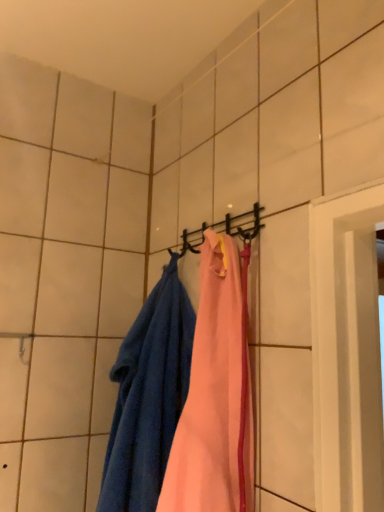
Measure the distance between blue terry cloth towel at left and camera.

blue terry cloth towel at left and camera are 76.22 centimeters apart from each other.

Image resolution: width=384 pixels, height=512 pixels. What do you see at coordinates (148, 396) in the screenshot?
I see `blue terry cloth towel at left` at bounding box center [148, 396].

Locate an element on the screen. This screenshot has width=384, height=512. blue terry cloth towel at left is located at coordinates (148, 396).

Find the location of a particular element. The image size is (384, 512). metallic black hanger at center is located at coordinates (225, 229).

This screenshot has width=384, height=512. Describe the element at coordinates (225, 229) in the screenshot. I see `metallic black hanger at center` at that location.

Find the location of `blue terry cloth towel at left`. blue terry cloth towel at left is located at coordinates (148, 396).

Which object is positioned more to the right, metallic black hanger at center or blue terry cloth towel at left?

metallic black hanger at center.

Is the depth of metallic black hanger at center less than that of blue terry cloth towel at left?

No, metallic black hanger at center is further to the viewer.

Which is in front, point (248, 220) or point (129, 396)?

The point (248, 220) is in front.

From the image's perspective, who appears lower, metallic black hanger at center or blue terry cloth towel at left?

blue terry cloth towel at left, from the image's perspective.

From a real-world perspective, between metallic black hanger at center and blue terry cloth towel at left, who is vertically lower?

From a 3D spatial view, blue terry cloth towel at left is below.

Looking at their sizes, would you say metallic black hanger at center is wider or thinner than blue terry cloth towel at left?

Considering their sizes, metallic black hanger at center looks slimmer than blue terry cloth towel at left.

Which of these two, metallic black hanger at center or blue terry cloth towel at left, stands shorter?

Standing shorter between the two is metallic black hanger at center.

Based on their sizes in the image, would you say metallic black hanger at center is bigger or smaller than blue terry cloth towel at left?

metallic black hanger at center is smaller than blue terry cloth towel at left.

Is metallic black hanger at center positioned beyond the bounds of blue terry cloth towel at left?

Indeed, metallic black hanger at center is completely outside blue terry cloth towel at left.

Can you see metallic black hanger at center touching blue terry cloth towel at left?

No, metallic black hanger at center is not next to blue terry cloth towel at left.

Is metallic black hanger at center positioned with its back to blue terry cloth towel at left?

That's right, metallic black hanger at center is facing away from blue terry cloth towel at left.

How different are the orientations of metallic black hanger at center and blue terry cloth towel at left in degrees?

The angle between the facing direction of metallic black hanger at center and the facing direction of blue terry cloth towel at left is 0.000777 degrees.

Locate an element on the screen. The height and width of the screenshot is (512, 384). hanger that is on the right side of blue terry cloth towel at left is located at coordinates (225, 229).

Is blue terry cloth towel at left at the left side of metallic black hanger at center?

Indeed, blue terry cloth towel at left is positioned on the left side of metallic black hanger at center.

Which object is further away from the camera, blue terry cloth towel at left or metallic black hanger at center?

metallic black hanger at center is further from the camera.

Is point (159, 450) in front of point (254, 227)?

No.

From the image's perspective, who appears lower, blue terry cloth towel at left or metallic black hanger at center?

blue terry cloth towel at left is shown below in the image.

From a real-world perspective, is blue terry cloth towel at left above or below metallic black hanger at center?

blue terry cloth towel at left is situated lower than metallic black hanger at center in the real world.

Looking at their sizes, would you say blue terry cloth towel at left is wider or thinner than metallic black hanger at center?

Considering their sizes, blue terry cloth towel at left looks broader than metallic black hanger at center.

In terms of height, does blue terry cloth towel at left look taller or shorter compared to metallic black hanger at center?

Considering their sizes, blue terry cloth towel at left has more height than metallic black hanger at center.

Considering the relative sizes of blue terry cloth towel at left and metallic black hanger at center in the image provided, is blue terry cloth towel at left bigger than metallic black hanger at center?

Indeed, blue terry cloth towel at left has a larger size compared to metallic black hanger at center.

Would you say blue terry cloth towel at left is inside or outside metallic black hanger at center?

blue terry cloth towel at left is not enclosed by metallic black hanger at center.

Is blue terry cloth towel at left far from metallic black hanger at center?

No, there isn't a large distance between blue terry cloth towel at left and metallic black hanger at center.

Does blue terry cloth towel at left turn towards metallic black hanger at center?

No.

What's the angular difference between blue terry cloth towel at left and metallic black hanger at center's facing directions?

They differ by 0.000777 degrees in their facing directions.

How much distance is there between blue terry cloth towel at left and metallic black hanger at center?

blue terry cloth towel at left and metallic black hanger at center are 11.18 inches apart.

I want to click on towel on the left side of metallic black hanger at center, so click(x=148, y=396).

Where is `towel on the left of metallic black hanger at center`? towel on the left of metallic black hanger at center is located at coordinates (148, 396).

In order to click on hanger above the blue terry cloth towel at left (from the image's perspective) in this screenshot , I will do `click(225, 229)`.